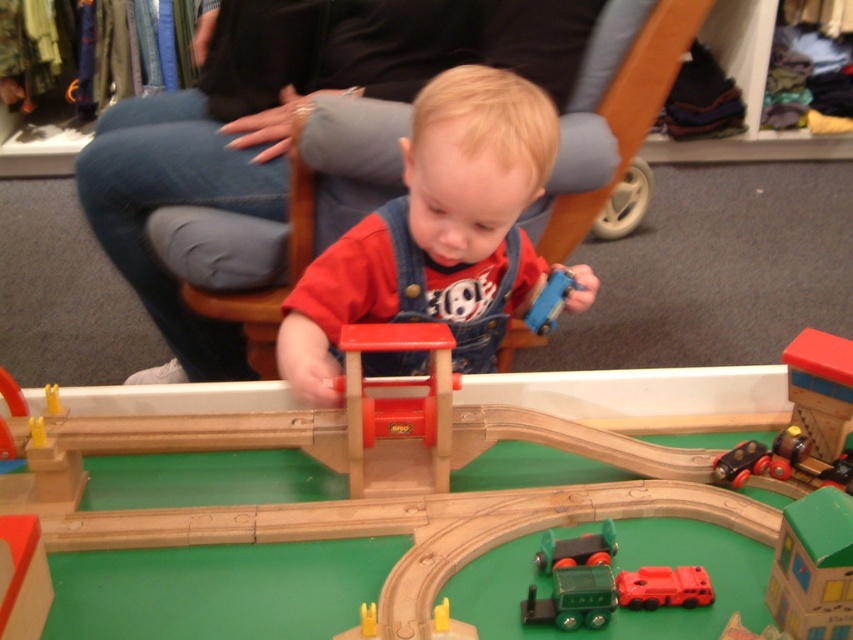
Question: Which object is the closest to the wooden train station at center?

Choices:
 (A) green matte train at center
 (B) denim overalls at center
 (C) blue plastic car at center
 (D) metallic black train at lower right

Answer: (B)

Question: Among these objects, which one is farthest from the camera?

Choices:
 (A) green matte train at center
 (B) rubber red fire truck at lower center
 (C) wooden train station at center

Answer: (C)

Question: Can you confirm if green matte train at center is thinner than blue plastic car at center?

Choices:
 (A) no
 (B) yes

Answer: (B)

Question: Estimate the real-world distances between objects in this image. Which object is closer to the rubber red fire truck at lower center?

Choices:
 (A) blue plastic car at center
 (B) wooden bridge at center

Answer: (B)

Question: Does denim overalls at center appear over rubber red fire truck at lower center?

Choices:
 (A) yes
 (B) no

Answer: (A)

Question: Does green matte train at center appear on the left side of metallic black train at lower right?

Choices:
 (A) yes
 (B) no

Answer: (A)